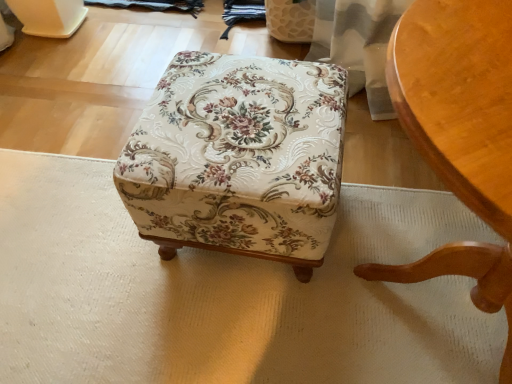
Where is `vacant point above floral fabric ottoman at center (from a real-world perspective)`? vacant point above floral fabric ottoman at center (from a real-world perspective) is located at coordinates (234, 106).